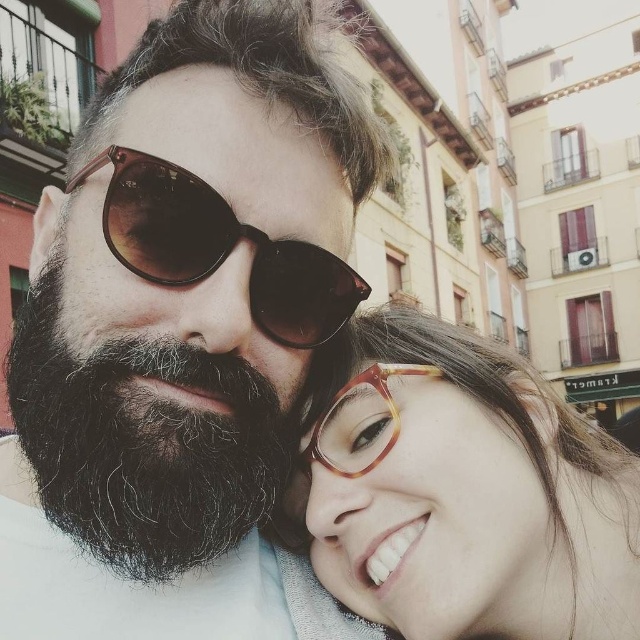
You are taking a photo and want to focus on the two points in the image. Which point, point (227, 19) or point (436, 490), is closer to the camera?

Point (227, 19) is closer to the camera than point (436, 490).